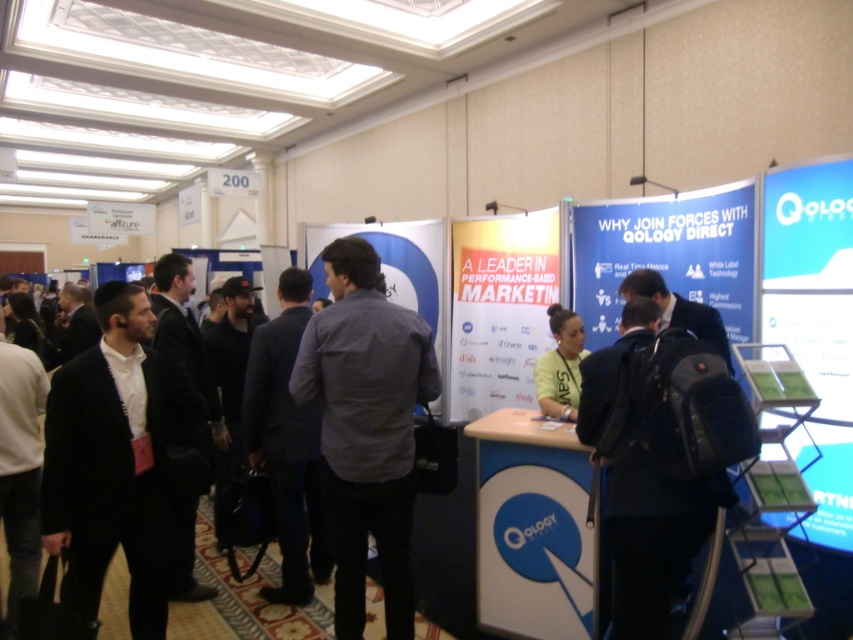
Locate an element on the screen. gray cotton shirt at center is located at coordinates (366, 428).

Is gray cotton shirt at center positioned before black fabric backpack at center?

No, it is behind black fabric backpack at center.

Does point (345, 483) come closer to viewer compared to point (624, 612)?

No, it is behind (624, 612).

In order to click on gray cotton shirt at center in this screenshot , I will do `click(366, 428)`.

Which is in front, point (96, 396) or point (268, 372)?

Point (96, 396) is in front.

Is point (55, 525) farther from viewer compared to point (281, 413)?

No, (55, 525) is in front of (281, 413).

This screenshot has width=853, height=640. Describe the element at coordinates (109, 464) in the screenshot. I see `black matte suit at left` at that location.

Where is `black matte suit at left`? This screenshot has width=853, height=640. black matte suit at left is located at coordinates (109, 464).

Is black matte suit at left bigger than yellow fabric shirt at center?

Actually, black matte suit at left might be smaller than yellow fabric shirt at center.

Does point (135, 608) come closer to viewer compared to point (572, 376)?

Yes, point (135, 608) is closer to viewer.

You are a GUI agent. You are given a task and a screenshot of the screen. Output one action in this format:
    pyautogui.click(x=<x>, y=<y>)
    Task: Click on the black matte suit at left
    This screenshot has width=853, height=640.
    Given the screenshot: What is the action you would take?
    pyautogui.click(x=109, y=464)